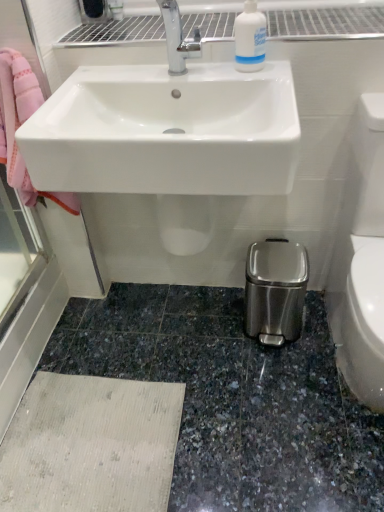
At what (x,y) coordinates should I click in order to perform the action: click on white glossy toilet bowl at lower right. Please return your answer as a coordinate pair (x, y). This screenshot has width=384, height=512. Looking at the image, I should click on (361, 261).

Does white glossy toilet bowl at lower right turn towards white plastic bottle at upper center?

No, white glossy toilet bowl at lower right is not aimed at white plastic bottle at upper center.

Considering the sizes of objects white glossy toilet bowl at lower right and white plastic bottle at upper center in the image provided, who is thinner, white glossy toilet bowl at lower right or white plastic bottle at upper center?

white plastic bottle at upper center.

Which of these two, white glossy toilet bowl at lower right or white plastic bottle at upper center, stands shorter?

white plastic bottle at upper center is shorter.

Is white plastic bottle at upper center oriented towards white glossy sink at upper center?

Yes, white plastic bottle at upper center is facing white glossy sink at upper center.

Which is behind, white plastic bottle at upper center or white glossy sink at upper center?

white plastic bottle at upper center is more distant.

From the image's perspective, is white plastic bottle at upper center above white glossy sink at upper center?

Yes, from the image's perspective, white plastic bottle at upper center is above white glossy sink at upper center.

What's the angular difference between white plastic bottle at upper center and white glossy sink at upper center's facing directions?

There is a 0.835-degree angle between the facing directions of white plastic bottle at upper center and white glossy sink at upper center.

How many degrees apart are the facing directions of white plastic bottle at upper center and white glossy toilet bowl at lower right?

1.04 degrees separate the facing orientations of white plastic bottle at upper center and white glossy toilet bowl at lower right.

From the image's perspective, between white plastic bottle at upper center and white glossy toilet bowl at lower right, who is located below?

white glossy toilet bowl at lower right is shown below in the image.

Based on the photo, how far apart are white plastic bottle at upper center and white glossy toilet bowl at lower right?

They are 23.10 inches apart.

Consider the image. Considering the relative positions of white plastic bottle at upper center and white glossy toilet bowl at lower right in the image provided, is white plastic bottle at upper center behind white glossy toilet bowl at lower right?

Yes, white plastic bottle at upper center is further from the camera.

Does point (365, 388) come behind point (288, 155)?

Yes, point (365, 388) is farther from viewer.

Does white glossy toilet bowl at lower right touch white glossy sink at upper center?

There is a gap between white glossy toilet bowl at lower right and white glossy sink at upper center.

Consider the image. Is white glossy toilet bowl at lower right turned away from white glossy sink at upper center?

That's not correct — white glossy toilet bowl at lower right is not looking away from white glossy sink at upper center.

This screenshot has width=384, height=512. I want to click on toilet bowl that appears on the right of white glossy sink at upper center, so click(361, 261).

Is white glossy sink at upper center facing away from white glossy toilet bowl at lower right?

white glossy sink at upper center is not turned away from white glossy toilet bowl at lower right.

Looking at their sizes, would you say white glossy sink at upper center is wider or thinner than white glossy toilet bowl at lower right?

Considering their sizes, white glossy sink at upper center looks slimmer than white glossy toilet bowl at lower right.

Is the surface of white glossy sink at upper center in direct contact with white glossy toilet bowl at lower right?

They are not placed beside each other.

From the image's perspective, which one is positioned higher, white glossy sink at upper center or white plastic bottle at upper center?

white plastic bottle at upper center, from the image's perspective.

Is white glossy sink at upper center closer to the viewer compared to white plastic bottle at upper center?

Yes, white glossy sink at upper center is in front of white plastic bottle at upper center.

How much distance is there between white glossy sink at upper center and white plastic bottle at upper center?

A distance of 30.25 centimeters exists between white glossy sink at upper center and white plastic bottle at upper center.

Is white glossy sink at upper center positioned with its back to white plastic bottle at upper center?

No, white plastic bottle at upper center is not at the back of white glossy sink at upper center.

You are a GUI agent. You are given a task and a screenshot of the screen. Output one action in this format:
    pyautogui.click(x=<x>, y=<y>)
    Task: Click on the cleaning product on the left of white glossy toilet bowl at lower right
    The width and height of the screenshot is (384, 512).
    Given the screenshot: What is the action you would take?
    pyautogui.click(x=250, y=38)

This screenshot has height=512, width=384. I want to click on sink below the white plastic bottle at upper center (from a real-world perspective), so click(x=167, y=132).

From the image, which object appears to be farther from white glossy sink at upper center, white plastic bottle at upper center or white glossy toilet bowl at lower right?

Among the two, white glossy toilet bowl at lower right is located further to white glossy sink at upper center.

From the image, which object appears to be nearer to white glossy sink at upper center, white glossy toilet bowl at lower right or white plastic bottle at upper center?

white plastic bottle at upper center.

Which object lies further to the anchor point white glossy toilet bowl at lower right, white glossy sink at upper center or white plastic bottle at upper center?

white plastic bottle at upper center lies further to white glossy toilet bowl at lower right than the other object.

When comparing their distances from white glossy toilet bowl at lower right, does white plastic bottle at upper center or white glossy sink at upper center seem closer?

Based on the image, white glossy sink at upper center appears to be nearer to white glossy toilet bowl at lower right.

From the image, which object appears to be farther from white plastic bottle at upper center, white glossy sink at upper center or white glossy toilet bowl at lower right?

white glossy toilet bowl at lower right is further to white plastic bottle at upper center.

Based on their spatial positions, is white glossy toilet bowl at lower right or white glossy sink at upper center further from white plastic bottle at upper center?

The object further to white plastic bottle at upper center is white glossy toilet bowl at lower right.

Locate an element on the screen. The height and width of the screenshot is (512, 384). sink between white plastic bottle at upper center and white glossy toilet bowl at lower right vertically is located at coordinates (167, 132).